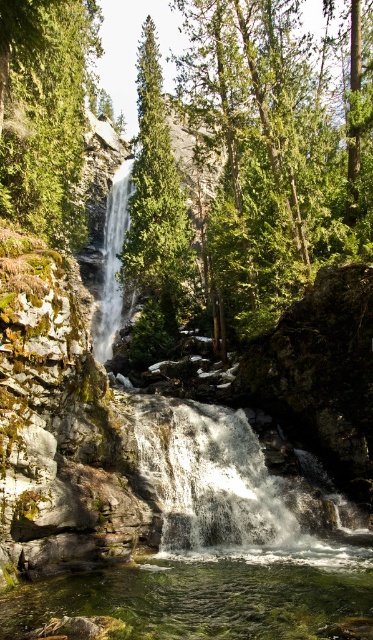
Is clear water at center positioned before white textured waterfall at center?

Yes, clear water at center is closer to the viewer.

Does clear water at center come behind white textured waterfall at center?

That is False.

Is point (98, 604) positioned before point (117, 188)?

Yes, point (98, 604) is in front of point (117, 188).

In order to click on clear water at center in this screenshot , I will do `click(207, 595)`.

Who is lower down, white frothy water at center or white textured waterfall at center?

white frothy water at center is below.

Where is `white frothy water at center`? The width and height of the screenshot is (373, 640). white frothy water at center is located at coordinates [x=209, y=477].

Consider the image. Who is more forward, (49, 593) or (145, 22)?

Point (49, 593)

Can you confirm if clear water at center is positioned to the left of green matte tree at center?

No, clear water at center is not to the left of green matte tree at center.

Is point (136, 589) closer to viewer compared to point (165, 220)?

Yes, point (136, 589) is in front of point (165, 220).

Locate an element on the screen. Image resolution: width=373 pixels, height=640 pixels. clear water at center is located at coordinates coord(207,595).